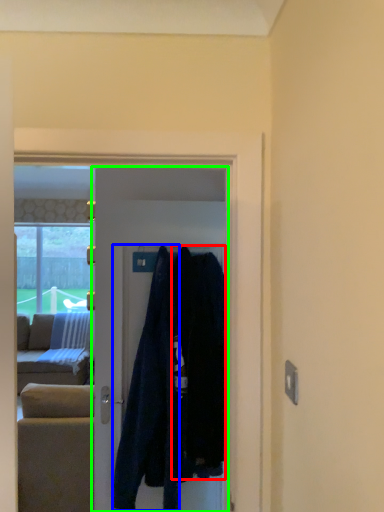
Question: Which object is positioned farthest from clothing (highlighted by a red box)? Select from clothing (highlighted by a blue box) and door (highlighted by a green box).

Choices:
 (A) clothing
 (B) door

Answer: (B)